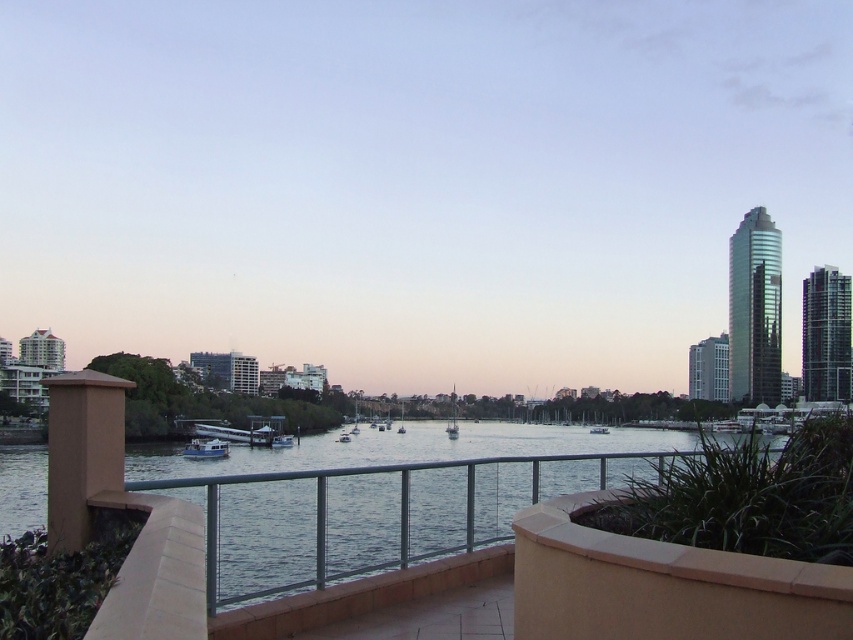
Does point (154, 464) come closer to viewer compared to point (276, 444)?

Yes, it is in front of point (276, 444).

Can you confirm if clear water at center is taller than white glossy boat at center?

Indeed, clear water at center has a greater height compared to white glossy boat at center.

Between point (650, 429) and point (283, 440), which one is positioned in front?

Point (283, 440)

You are a GUI agent. You are given a task and a screenshot of the screen. Output one action in this format:
    pyautogui.click(x=<x>, y=<y>)
    Task: Click on the clear water at center
    Image resolution: width=853 pixels, height=640 pixels.
    Given the screenshot: What is the action you would take?
    pyautogui.click(x=403, y=449)

Can you confirm if metallic blue boat at center is taller than white glossy boat at center?

Correct, metallic blue boat at center is much taller as white glossy boat at center.

Who is positioned more to the right, metallic blue boat at center or white glossy boat at center?

From the viewer's perspective, white glossy boat at center appears more on the right side.

Measure the distance between metallic blue boat at center and camera.

The distance of metallic blue boat at center from camera is 74.75 meters.

Identify the location of metallic blue boat at center. This screenshot has height=640, width=853. (206, 449).

Who is more distant from viewer, (141, 474) or (213, 452)?

Point (213, 452)

Can you confirm if clear water at center is positioned above metallic blue boat at center?

No.

Between point (485, 468) and point (225, 444), which one is positioned behind?

The point (225, 444) is more distant.

This screenshot has height=640, width=853. What are the coordinates of `clear water at center` in the screenshot? It's located at (403, 449).